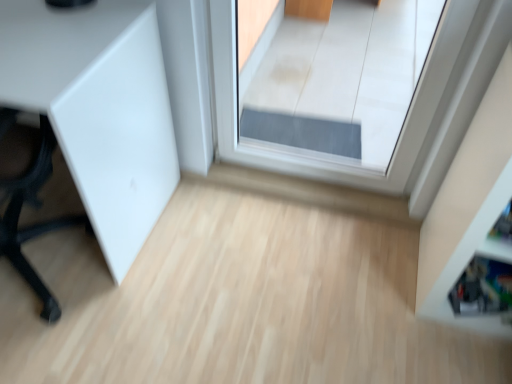
Question: Considering the relative sizes of white glossy shelf at right and transparent glass door at center in the image provided, is white glossy shelf at right smaller than transparent glass door at center?

Choices:
 (A) yes
 (B) no

Answer: (B)

Question: Considering the relative sizes of white glossy shelf at right and transparent glass door at center in the image provided, is white glossy shelf at right thinner than transparent glass door at center?

Choices:
 (A) no
 (B) yes

Answer: (A)

Question: Is white glossy shelf at right bigger than transparent glass door at center?

Choices:
 (A) yes
 (B) no

Answer: (A)

Question: Is the position of white glossy shelf at right more distant than that of transparent glass door at center?

Choices:
 (A) yes
 (B) no

Answer: (B)

Question: Can you confirm if white glossy shelf at right is shorter than transparent glass door at center?

Choices:
 (A) no
 (B) yes

Answer: (B)

Question: From their relative heights in the image, would you say transparent glass door at center is taller or shorter than white matte cabinet at left?

Choices:
 (A) short
 (B) tall

Answer: (B)

Question: Does point (295, 105) appear closer or farther from the camera than point (110, 36)?

Choices:
 (A) closer
 (B) farther

Answer: (B)

Question: Considering the relative positions of transparent glass door at center and white matte cabinet at left in the image provided, is transparent glass door at center to the left or to the right of white matte cabinet at left?

Choices:
 (A) right
 (B) left

Answer: (A)

Question: From the image's perspective, is transparent glass door at center located above or below white matte cabinet at left?

Choices:
 (A) below
 (B) above

Answer: (B)

Question: Is point (484, 327) closer or farther from the camera than point (51, 319)?

Choices:
 (A) closer
 (B) farther

Answer: (B)

Question: Considering the positions of white glossy shelf at right and white matte cabinet at left in the image, is white glossy shelf at right bigger or smaller than white matte cabinet at left?

Choices:
 (A) big
 (B) small

Answer: (B)

Question: From the image's perspective, is white glossy shelf at right located above or below white matte cabinet at left?

Choices:
 (A) above
 (B) below

Answer: (B)

Question: From a real-world perspective, is white glossy shelf at right physically located above or below white matte cabinet at left?

Choices:
 (A) below
 (B) above

Answer: (B)

Question: From the image's perspective, is white matte cabinet at left above or below white glossy shelf at right?

Choices:
 (A) above
 (B) below

Answer: (A)

Question: Is point (56, 225) closer or farther from the camera than point (497, 188)?

Choices:
 (A) closer
 (B) farther

Answer: (B)